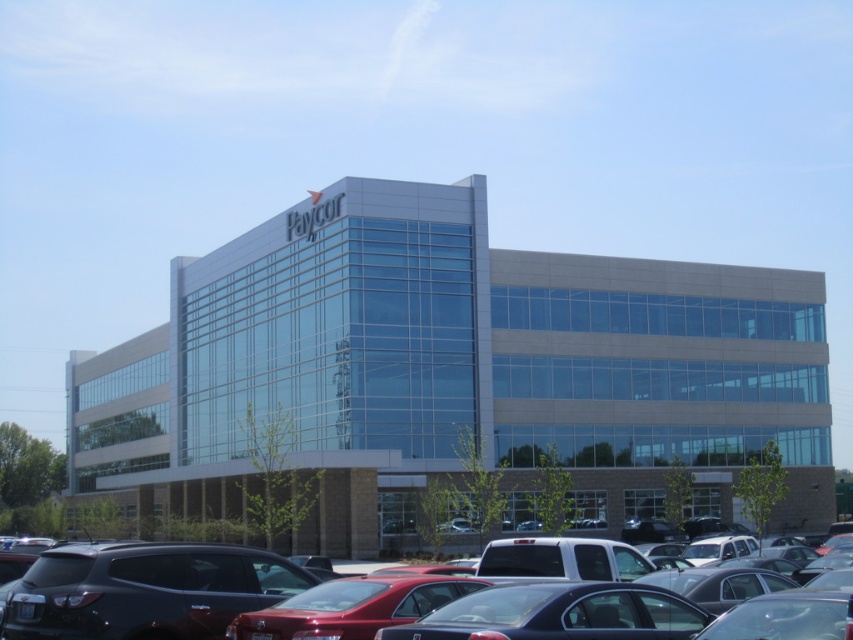
Question: Does matte black sedan at center appear on the right side of glossy black suv at lower left?

Choices:
 (A) no
 (B) yes

Answer: (B)

Question: Which object is closer to the camera taking this photo?

Choices:
 (A) glossy black suv at lower left
 (B) matte black sedan at center

Answer: (B)

Question: Is matte black sedan at center to the right of glossy black suv at lower left from the viewer's perspective?

Choices:
 (A) yes
 (B) no

Answer: (A)

Question: Which object appears farthest from the camera in this image?

Choices:
 (A) matte black sedan at center
 (B) glossy black suv at lower left

Answer: (B)

Question: Can you confirm if matte black sedan at center is positioned to the left of glossy black suv at lower left?

Choices:
 (A) yes
 (B) no

Answer: (B)